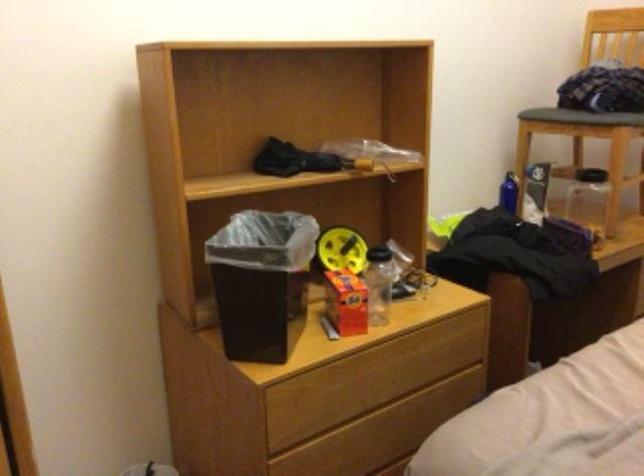
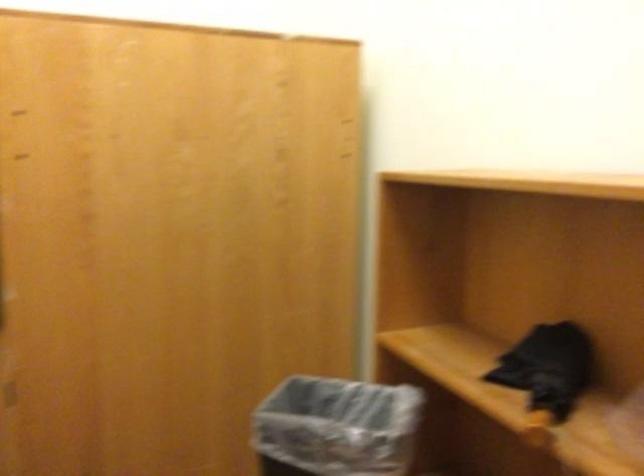
In the second image, find the point that corresponds to point (266, 231) in the first image.

(337, 426)